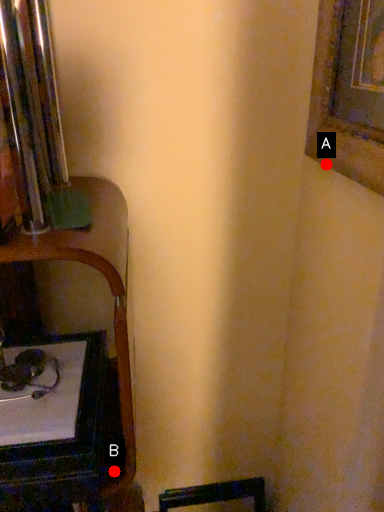
Question: Two points are circled on the image, labeled by A and B beside each circle. Among these points, which one is farthest from the camera?

Choices:
 (A) A is further
 (B) B is further

Answer: (A)